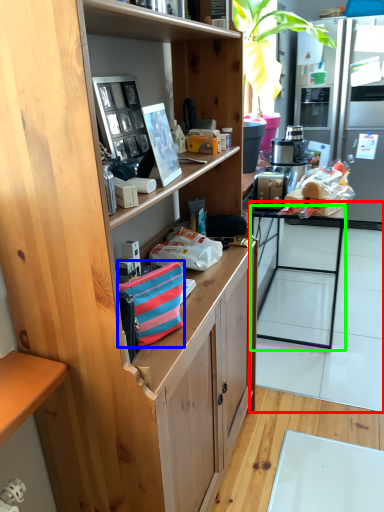
Question: Considering the real-world distances, which object is closest to table (highlighted by a red box)? handbag (highlighted by a blue box) or desk (highlighted by a green box).

Choices:
 (A) handbag
 (B) desk

Answer: (B)